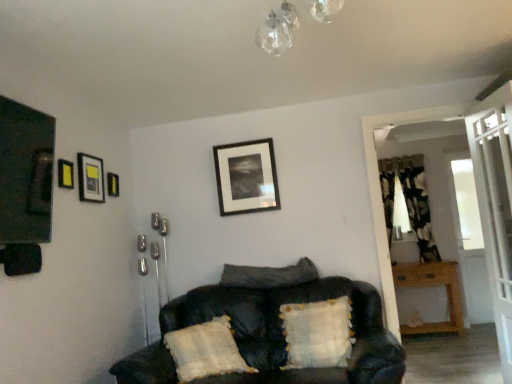
Question: In terms of height, does wooden table at right look taller or shorter compared to matte black picture frame at upper left, marked as the third picture frame in a back-to-front arrangement?

Choices:
 (A) tall
 (B) short

Answer: (A)

Question: Is wooden table at right in front of or behind matte black picture frame at upper left, which is the 2th picture frame from front to back, in the image?

Choices:
 (A) behind
 (B) front

Answer: (A)

Question: Estimate the real-world distances between objects in this image. Which object is farther from the white textured pillow at center, the first pillow positioned from the right?

Choices:
 (A) wooden table at right
 (B) transparent glass screen door at upper right, the 2th screen door from the back
 (C) floral fabric curtain at right
 (D) black leather couch at center
 (E) velvety dark gray pillow at center, arranged as the second pillow when viewed from the left

Answer: (C)

Question: Which is farther from the black matte picture frame at upper center, the first picture frame positioned from the back?

Choices:
 (A) transparent glass screen door at right, acting as the second screen door starting from the front
 (B) white textured pillow at center, which ranks as the 3th pillow in left-to-right order
 (C) black leather couch at center
 (D) matte black picture frame at upper left, marked as the third picture frame in a back-to-front arrangement
 (E) velvety dark gray pillow at center, arranged as the second pillow when viewed from the left

Answer: (D)